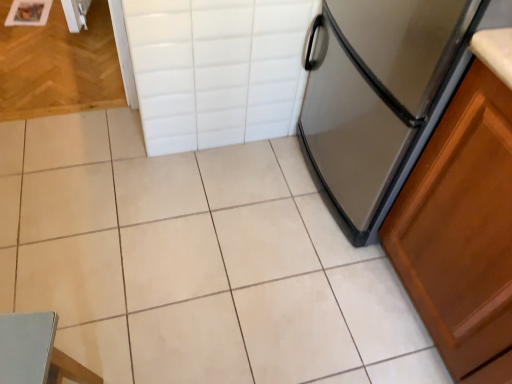
This screenshot has height=384, width=512. In order to click on vacant space that is in between satin silver refrigerator at right and white tile drawer at upper center in this screenshot , I will do `click(259, 182)`.